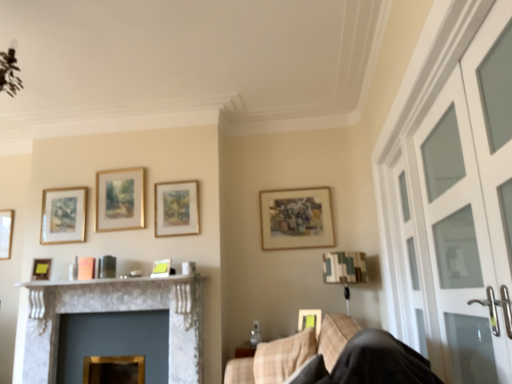
Question: Is matte green picture frame at center, which ranks as the first picture frame in right-to-left order, at the left side of beige fabric swivel chair at lower right?

Choices:
 (A) yes
 (B) no

Answer: (B)

Question: Is matte green picture frame at center, which ranks as the first picture frame in right-to-left order, bigger than beige fabric swivel chair at lower right?

Choices:
 (A) no
 (B) yes

Answer: (A)

Question: From a real-world perspective, is matte green picture frame at center, acting as the eighth picture frame starting from the left, on top of beige fabric swivel chair at lower right?

Choices:
 (A) no
 (B) yes

Answer: (B)

Question: Considering the relative sizes of matte green picture frame at center, which ranks as the first picture frame in right-to-left order, and beige fabric swivel chair at lower right in the image provided, is matte green picture frame at center, which ranks as the first picture frame in right-to-left order, wider than beige fabric swivel chair at lower right?

Choices:
 (A) yes
 (B) no

Answer: (B)

Question: Does matte green picture frame at center, acting as the eighth picture frame starting from the left, have a smaller size compared to beige fabric swivel chair at lower right?

Choices:
 (A) no
 (B) yes

Answer: (B)

Question: In terms of height, does white frosted glass screen door at right, the first screen door in the front-to-back sequence, look taller or shorter compared to clear glass screen door at right, placed as the second screen door when sorted from front to back?

Choices:
 (A) tall
 (B) short

Answer: (A)

Question: From the image's perspective, is white frosted glass screen door at right, acting as the 2th screen door starting from the back, located above or below clear glass screen door at right, which is the first screen door from back to front?

Choices:
 (A) below
 (B) above

Answer: (B)

Question: Considering the positions of white frosted glass screen door at right, acting as the 2th screen door starting from the back, and clear glass screen door at right, which is the first screen door from back to front, in the image, is white frosted glass screen door at right, acting as the 2th screen door starting from the back, bigger or smaller than clear glass screen door at right, which is the first screen door from back to front,?

Choices:
 (A) small
 (B) big

Answer: (B)

Question: In the image, is white frosted glass screen door at right, acting as the 2th screen door starting from the back, positioned in front of or behind clear glass screen door at right, which is the first screen door from back to front?

Choices:
 (A) behind
 (B) front

Answer: (B)

Question: From the image's perspective, is wooden picture frame at left, marked as the first picture frame in a left-to-right arrangement, located above or below matte gold picture frame at left, arranged as the second picture frame when viewed from the left?

Choices:
 (A) above
 (B) below

Answer: (A)

Question: In terms of width, does wooden picture frame at left, marked as the first picture frame in a left-to-right arrangement, look wider or thinner when compared to matte gold picture frame at left, which is the 7th picture frame in right-to-left order?

Choices:
 (A) wide
 (B) thin

Answer: (B)

Question: Based on their sizes in the image, would you say wooden picture frame at left, which ranks as the 8th picture frame in right-to-left order, is bigger or smaller than matte gold picture frame at left, which is the 7th picture frame in right-to-left order?

Choices:
 (A) big
 (B) small

Answer: (B)

Question: Is wooden picture frame at left, marked as the first picture frame in a left-to-right arrangement, inside the boundaries of matte gold picture frame at left, which is the 7th picture frame in right-to-left order, or outside?

Choices:
 (A) outside
 (B) inside

Answer: (A)

Question: Considering the positions of beige fabric swivel chair at lower right and gold-framed picture at upper center, which appears as the fifth picture frame when viewed from the right, in the image, is beige fabric swivel chair at lower right wider or thinner than gold-framed picture at upper center, which appears as the fifth picture frame when viewed from the right,?

Choices:
 (A) wide
 (B) thin

Answer: (A)

Question: Does point (288, 337) appear closer or farther from the camera than point (96, 208)?

Choices:
 (A) closer
 (B) farther

Answer: (A)